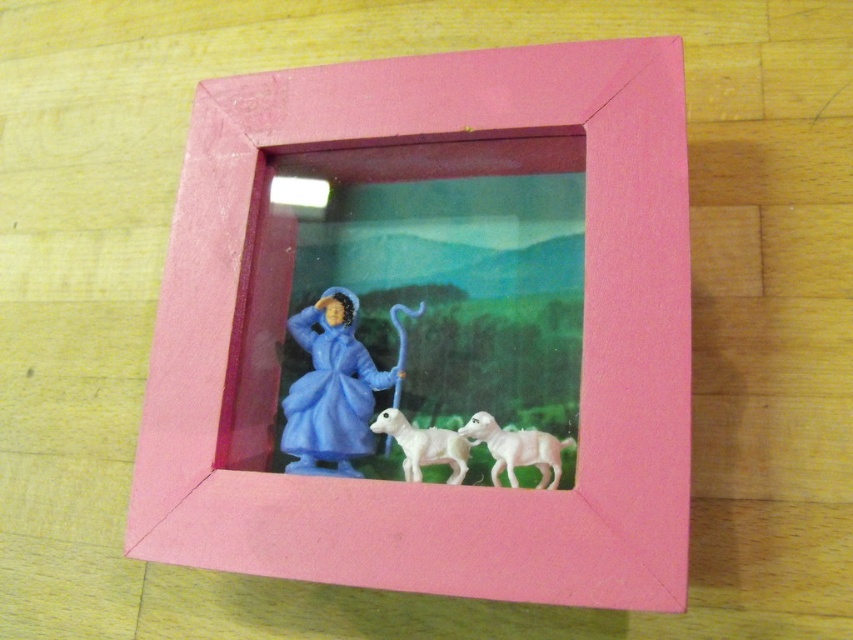
Question: Does blue plastic figurine at center come in front of white plastic dog at center?

Choices:
 (A) yes
 (B) no

Answer: (B)

Question: Estimate the real-world distances between objects in this image. Which object is farther from the pink wood frame at center?

Choices:
 (A) white plastic dog at center
 (B) blue plastic figurine at center

Answer: (A)

Question: Which of the following is the closest to the observer?

Choices:
 (A) (457, 435)
 (B) (393, 317)
 (C) (532, 449)

Answer: (C)

Question: Is blue plastic figurine at center smaller than white plastic dog at center?

Choices:
 (A) no
 (B) yes

Answer: (A)

Question: Does pink wood frame at center have a smaller size compared to white glossy sheep at lower center?

Choices:
 (A) no
 (B) yes

Answer: (A)

Question: Which point is farther to the camera?

Choices:
 (A) white plastic dog at center
 (B) white glossy sheep at lower center
 (C) pink wood frame at center

Answer: (A)